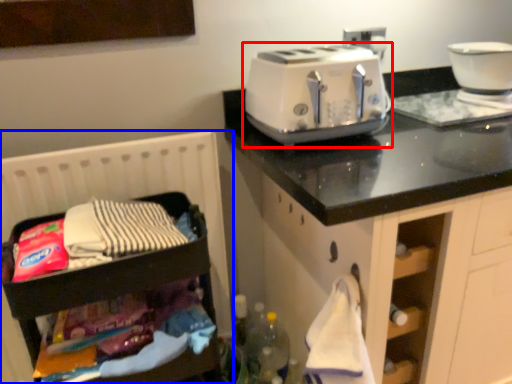
Question: Which object is closer to the camera taking this photo, toaster (highlighted by a red box) or infant bed (highlighted by a blue box)?

Choices:
 (A) toaster
 (B) infant bed

Answer: (B)